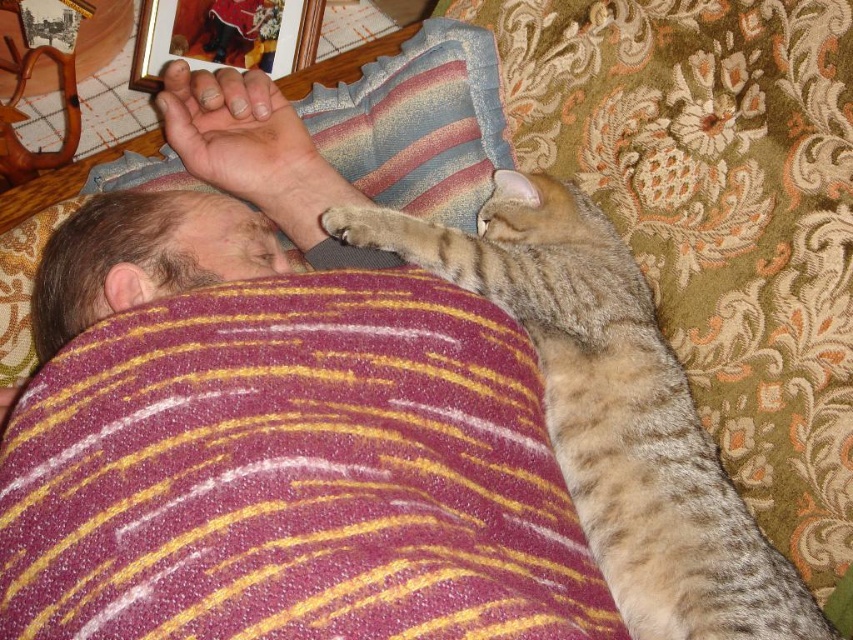
Question: Can you confirm if tabby fur cat at upper right is positioned above light brown fur paw at upper center?

Choices:
 (A) yes
 (B) no

Answer: (B)

Question: Which point is closer to the camera taking this photo?

Choices:
 (A) (236, 179)
 (B) (689, 540)

Answer: (B)

Question: Does tabby fur cat at upper right appear over light brown fur paw at upper center?

Choices:
 (A) no
 (B) yes

Answer: (A)

Question: Is tabby fur cat at upper right to the left of light brown fur paw at upper center from the viewer's perspective?

Choices:
 (A) no
 (B) yes

Answer: (A)